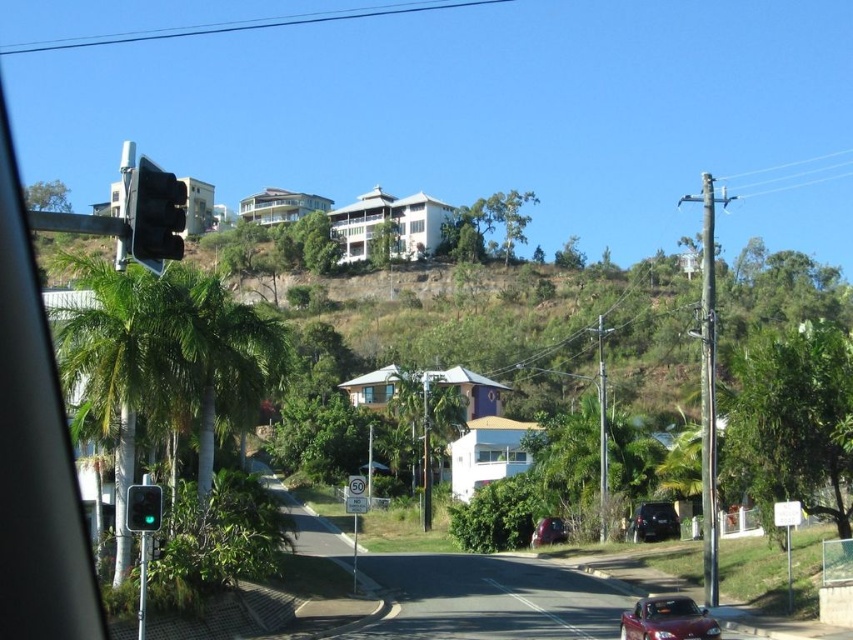
Question: Which of the following is the farthest from the observer?

Choices:
 (A) (131, 525)
 (B) (641, 506)

Answer: (B)

Question: Which object is farther from the camera taking this photo?

Choices:
 (A) green glass traffic light at left
 (B) shiny black sedan at lower right
 (C) metallic traffic light at left
 (D) shiny maroon car at lower right

Answer: (B)

Question: From the image, what is the correct spatial relationship of shiny maroon car at lower right in relation to green glass traffic light at left?

Choices:
 (A) right
 (B) left

Answer: (A)

Question: Is shiny maroon car at lower right in front of shiny black sedan at lower right?

Choices:
 (A) no
 (B) yes

Answer: (B)

Question: Which point is closer to the camera taking this photo?

Choices:
 (A) 636,605
 (B) 659,529
 (C) 163,198
 (D) 151,484

Answer: (C)

Question: Does metallic traffic light at left appear over shiny black sedan at lower right?

Choices:
 (A) no
 (B) yes

Answer: (B)